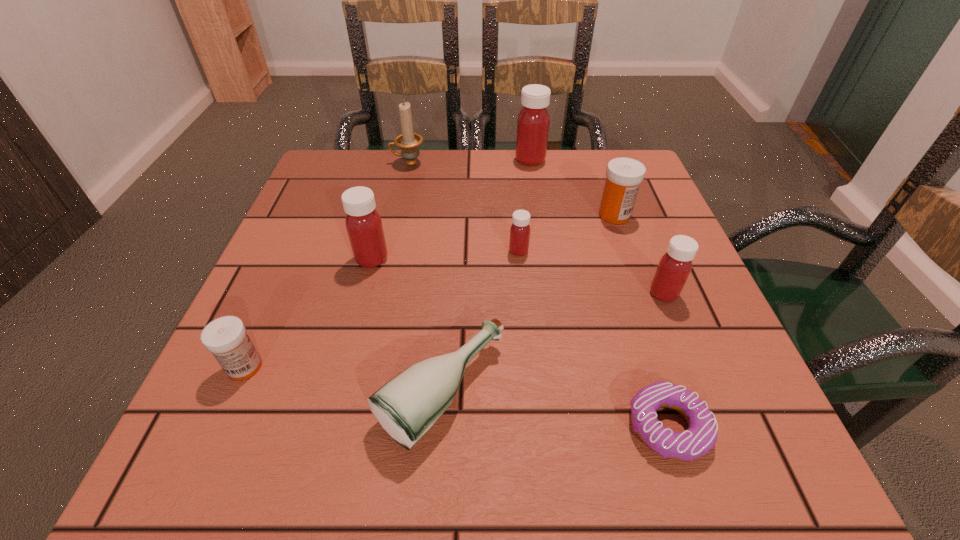
In order to click on the tallest medicine in this screenshot , I will do `click(533, 122)`.

Find the location of a particular element. This screenshot has height=540, width=960. the biggest red medicine is located at coordinates (533, 122).

Where is `candle_holder`? The height and width of the screenshot is (540, 960). candle_holder is located at coordinates (409, 142).

You are a GUI agent. You are given a task and a screenshot of the screen. Output one action in this format:
    pyautogui.click(x=<x>, y=<y>)
    Task: Click on the fifth medicine from right to left
    
    Given the screenshot: What is the action you would take?
    pyautogui.click(x=364, y=226)

Locate an element on the screen. the second tallest medicine is located at coordinates click(x=364, y=226).

Where is `the seventh nearest object`? The width and height of the screenshot is (960, 540). the seventh nearest object is located at coordinates (623, 176).

The image size is (960, 540). I want to click on the right white medicine, so click(623, 176).

Find the location of a particular element. the nearest red medicine is located at coordinates (675, 265).

This screenshot has width=960, height=540. In order to click on the second smallest red medicine in this screenshot , I will do 675,265.

Find the location of `the smallest red medicine`. the smallest red medicine is located at coordinates (520, 230).